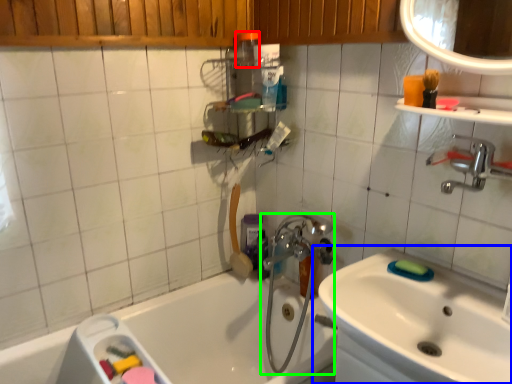
Question: Based on their relative distances, which object is farther from toiletry (highlighted by a red box)? Choose from sink (highlighted by a blue box) and plumbing fixture (highlighted by a green box).

Choices:
 (A) sink
 (B) plumbing fixture

Answer: (A)